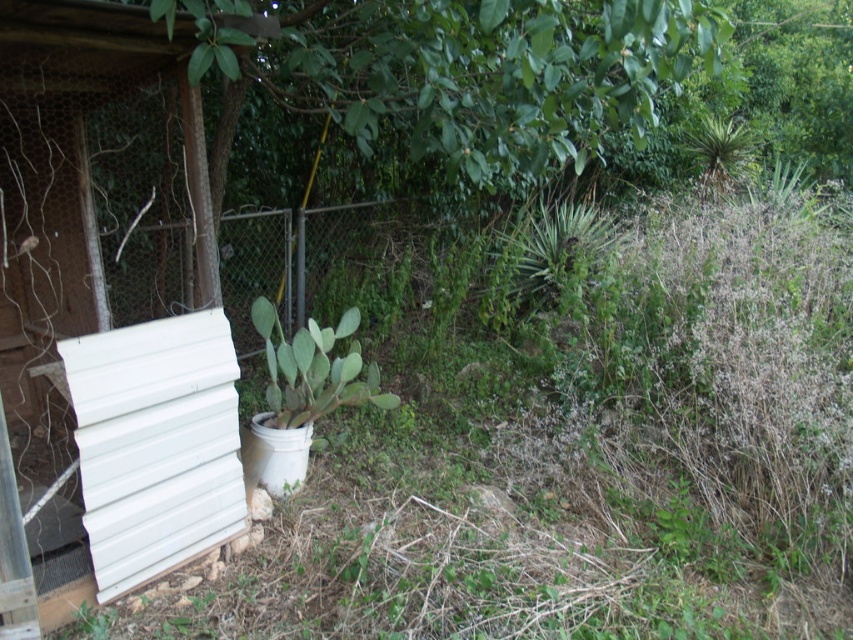
Identify the location of white corrugated metal hut at left. This screenshot has height=640, width=853. 70,168.

Between point (47, 170) and point (293, 259), which one is positioned in front?

Point (47, 170)

Find the location of `white corrugated metal hut at left`. white corrugated metal hut at left is located at coordinates (70, 168).